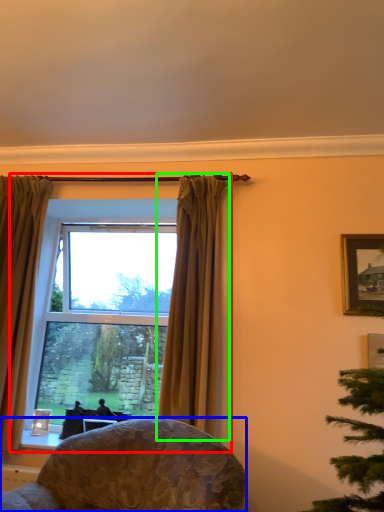
Question: Which object is the farthest from window (highlighted by a red box)? Choose among these: chair (highlighted by a blue box) or curtain (highlighted by a green box).

Choices:
 (A) chair
 (B) curtain

Answer: (B)